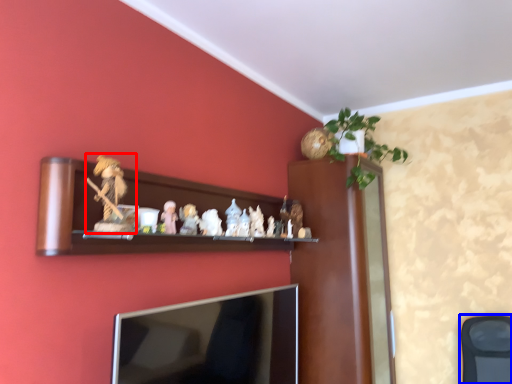
Question: Which point is further to the camera, toy (highlighted by a red box) or swivel chair (highlighted by a blue box)?

Choices:
 (A) toy
 (B) swivel chair

Answer: (B)